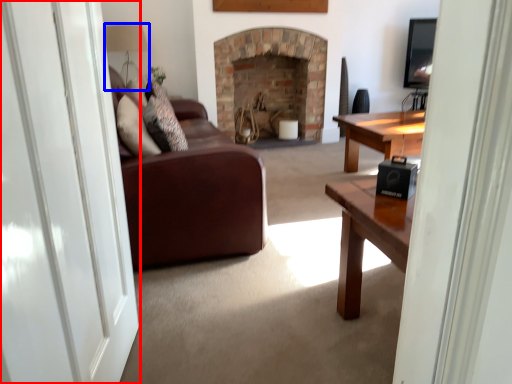
Question: Which object is further to the camera taking this photo, screen door (highlighted by a red box) or lamp (highlighted by a blue box)?

Choices:
 (A) screen door
 (B) lamp

Answer: (B)